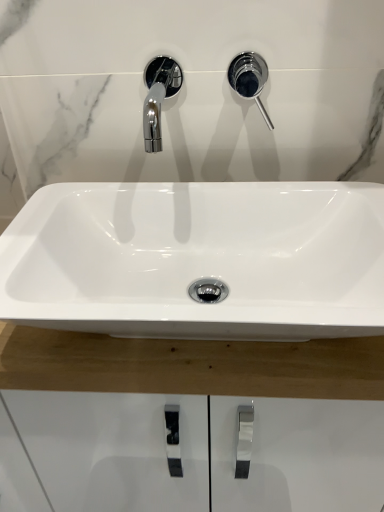
Question: From the image's perspective, is polished chrome faucet at upper right located above or below white glossy sink at center?

Choices:
 (A) above
 (B) below

Answer: (A)

Question: Considering their positions, is polished chrome faucet at upper right located in front of or behind white glossy sink at center?

Choices:
 (A) behind
 (B) front

Answer: (A)

Question: Is point (253, 74) closer or farther from the camera than point (137, 222)?

Choices:
 (A) farther
 (B) closer

Answer: (B)

Question: Is point (273, 240) closer or farther from the camera than point (258, 75)?

Choices:
 (A) farther
 (B) closer

Answer: (B)

Question: In terms of height, does white glossy sink at center look taller or shorter compared to polished chrome faucet at upper right?

Choices:
 (A) short
 (B) tall

Answer: (A)

Question: From the image's perspective, is white glossy sink at center located above or below polished chrome faucet at upper right?

Choices:
 (A) below
 (B) above

Answer: (A)

Question: Visually, is white glossy sink at center positioned to the left or to the right of polished chrome faucet at upper right?

Choices:
 (A) left
 (B) right

Answer: (A)